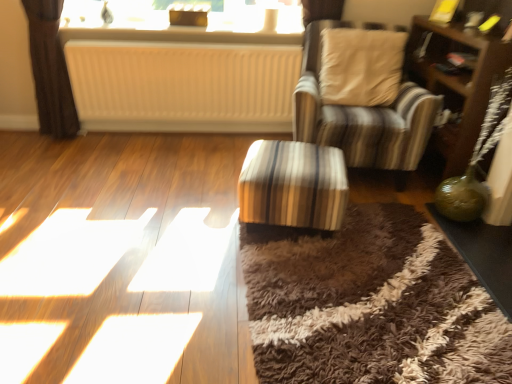
Question: From a real-world perspective, is brown wooden dresser at right beneath striped fabric chair at center?

Choices:
 (A) yes
 (B) no

Answer: (A)

Question: Does brown wooden dresser at right have a greater height compared to striped fabric chair at center?

Choices:
 (A) no
 (B) yes

Answer: (B)

Question: Does brown wooden dresser at right have a larger size compared to striped fabric chair at center?

Choices:
 (A) yes
 (B) no

Answer: (B)

Question: Is the depth of brown wooden dresser at right less than that of striped fabric chair at center?

Choices:
 (A) no
 (B) yes

Answer: (A)

Question: From the image's perspective, is brown wooden dresser at right on top of striped fabric chair at center?

Choices:
 (A) yes
 (B) no

Answer: (B)

Question: Can you confirm if brown wooden dresser at right is wider than striped fabric chair at center?

Choices:
 (A) yes
 (B) no

Answer: (B)

Question: Is white ribbed radiator at center to the left of brown wooden dresser at right from the viewer's perspective?

Choices:
 (A) no
 (B) yes

Answer: (B)

Question: From a real-world perspective, is white ribbed radiator at center physically below brown wooden dresser at right?

Choices:
 (A) yes
 (B) no

Answer: (A)

Question: Considering the relative sizes of white ribbed radiator at center and brown wooden dresser at right in the image provided, is white ribbed radiator at center taller than brown wooden dresser at right?

Choices:
 (A) no
 (B) yes

Answer: (A)

Question: Considering the relative sizes of white ribbed radiator at center and brown wooden dresser at right in the image provided, is white ribbed radiator at center thinner than brown wooden dresser at right?

Choices:
 (A) no
 (B) yes

Answer: (B)

Question: Does white ribbed radiator at center come behind brown wooden dresser at right?

Choices:
 (A) yes
 (B) no

Answer: (A)

Question: Is white ribbed radiator at center completely or partially outside of brown wooden dresser at right?

Choices:
 (A) no
 (B) yes

Answer: (B)

Question: Considering the relative sizes of white textured radiator at upper center and striped fabric ottoman at center, positioned as the 2th table in right-to-left order, in the image provided, is white textured radiator at upper center thinner than striped fabric ottoman at center, positioned as the 2th table in right-to-left order,?

Choices:
 (A) yes
 (B) no

Answer: (A)